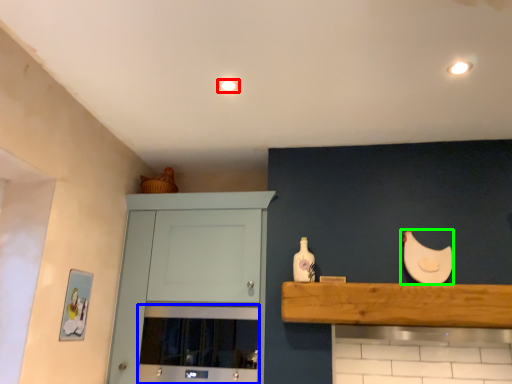
Question: Estimate the real-world distances between objects in this image. Which object is closer to lighting (highlighted by a red box), oven (highlighted by a blue box) or chicken (highlighted by a green box)?

Choices:
 (A) oven
 (B) chicken

Answer: (B)